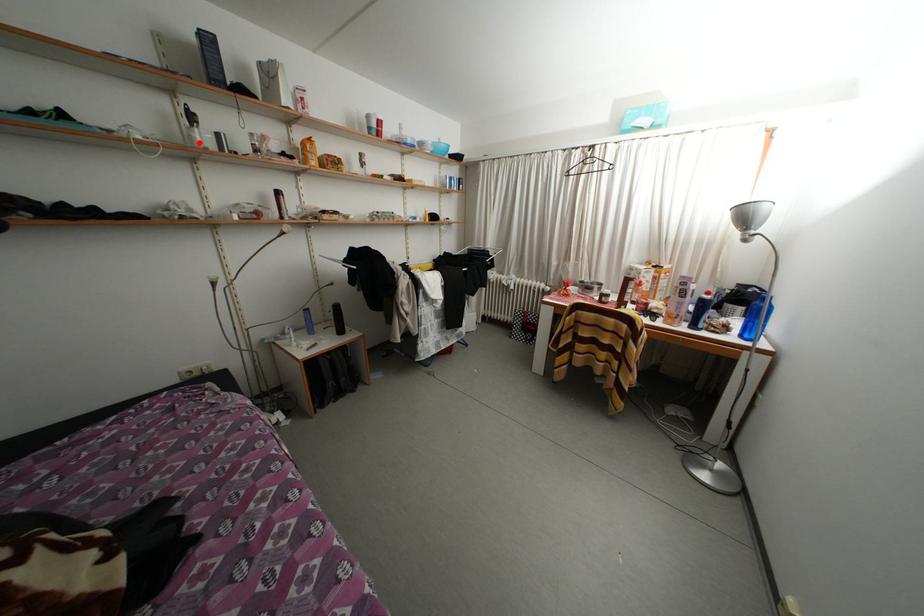
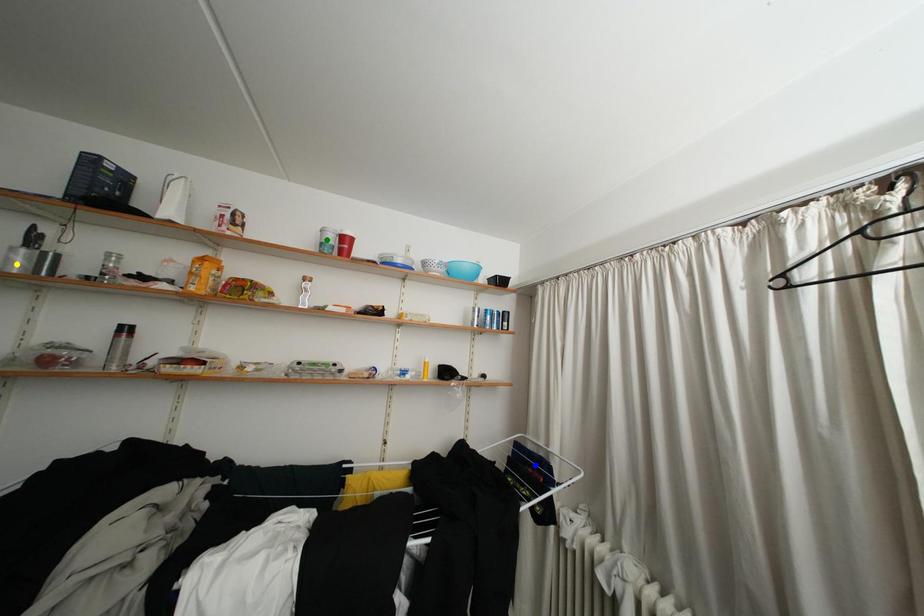
Question: I am providing you with two images of the same scene from different viewpoints. A red point is marked on the first image. You are given multiple points on the second image. Which spot in image 2 lines up with the point in image 1?

Choices:
 (A) yellow point
 (B) green point
 (C) blue point

Answer: (A)